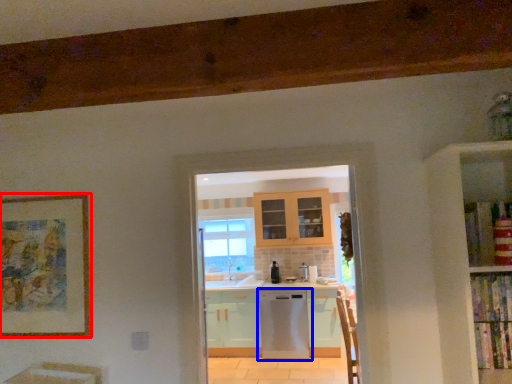
Question: Which of the following is the closest to the observer, picture frame (highlighted by a red box) or home appliance (highlighted by a blue box)?

Choices:
 (A) picture frame
 (B) home appliance

Answer: (A)